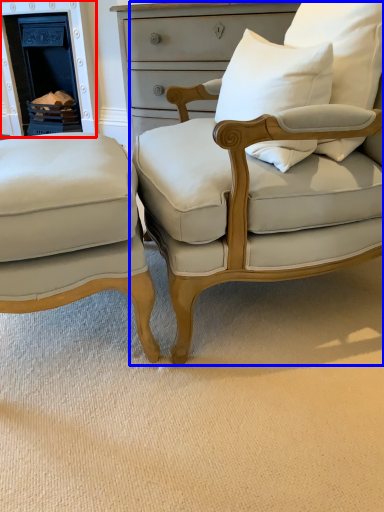
Question: Which of the following is the closest to the observer, fireplace (highlighted by a red box) or chair (highlighted by a blue box)?

Choices:
 (A) fireplace
 (B) chair

Answer: (B)